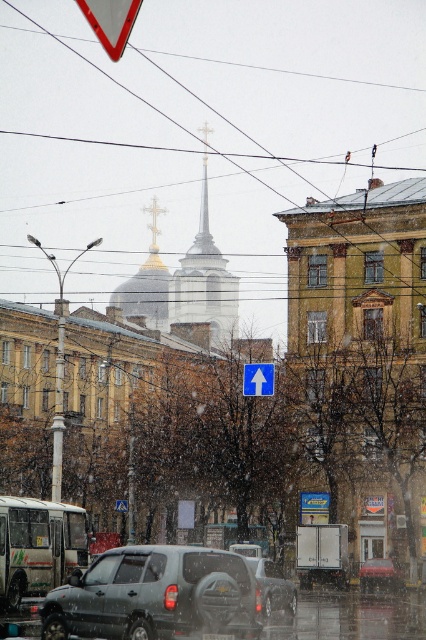
This screenshot has height=640, width=426. What do you see at coordinates (155, 595) in the screenshot?
I see `metallic gray suv at center` at bounding box center [155, 595].

Can you confirm if metallic gray suv at center is positioned above blue plastic arrow at center?

No, metallic gray suv at center is not above blue plastic arrow at center.

Between point (85, 598) and point (270, 369), which one is positioned behind?

Positioned behind is point (270, 369).

The width and height of the screenshot is (426, 640). I want to click on metallic gray suv at center, so click(155, 595).

Looking at this image, who is more distant from viewer, (172,321) or (394,573)?

The point (172,321) is more distant.

What do you see at coordinates (204, 278) in the screenshot? I see `smooth white spire at center` at bounding box center [204, 278].

Who is more forward, (195,244) or (400,580)?

Positioned in front is point (400,580).

Where is `smooth white spire at center`? The height and width of the screenshot is (640, 426). smooth white spire at center is located at coordinates (204, 278).

Is metallic silver suv at center to the left of blue plastic arrow at center from the viewer's perspective?

In fact, metallic silver suv at center is to the right of blue plastic arrow at center.

Identify the location of metallic silver suv at center. (379, 573).